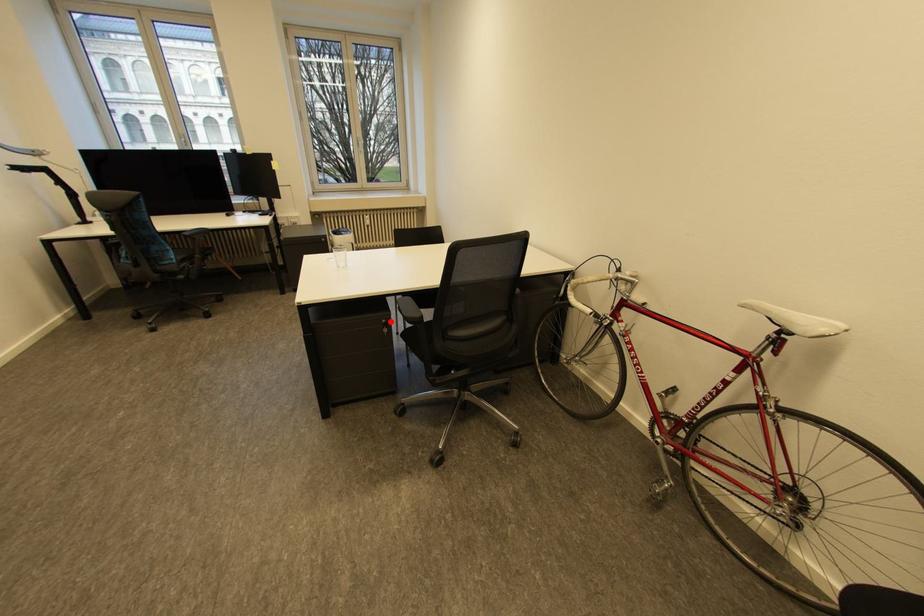
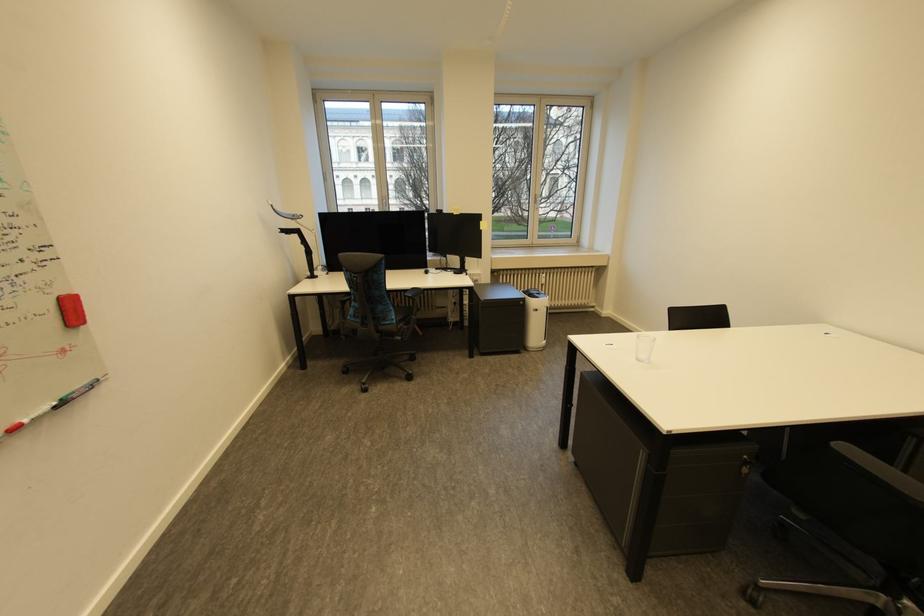
Question: I am providing you with two images of the same scene from different viewpoints. A red point is shown in image1. For the corresponding object point in image2, is it positioned nearer or farther from the camera?

Choices:
 (A) Nearer
 (B) Farther

Answer: (A)